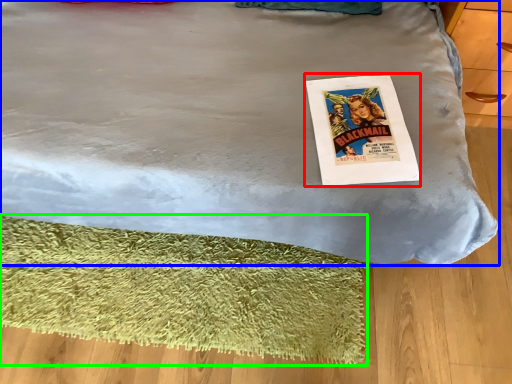
Question: Based on their relative distances, which object is farther from magazine (highlighted by a red box)? Choose from bed (highlighted by a blue box) and mat (highlighted by a green box).

Choices:
 (A) bed
 (B) mat

Answer: (B)